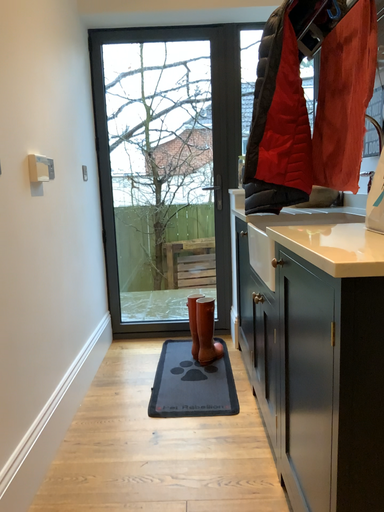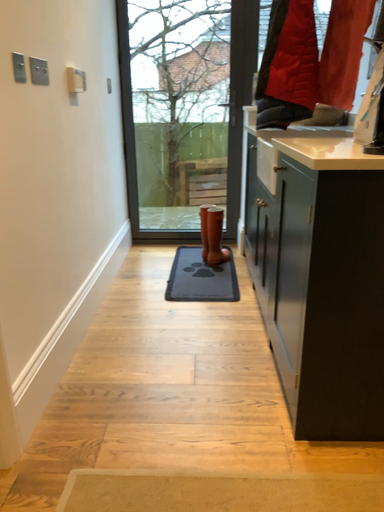
Question: How did the camera likely rotate when shooting the video?

Choices:
 (A) rotated upward
 (B) rotated downward

Answer: (B)